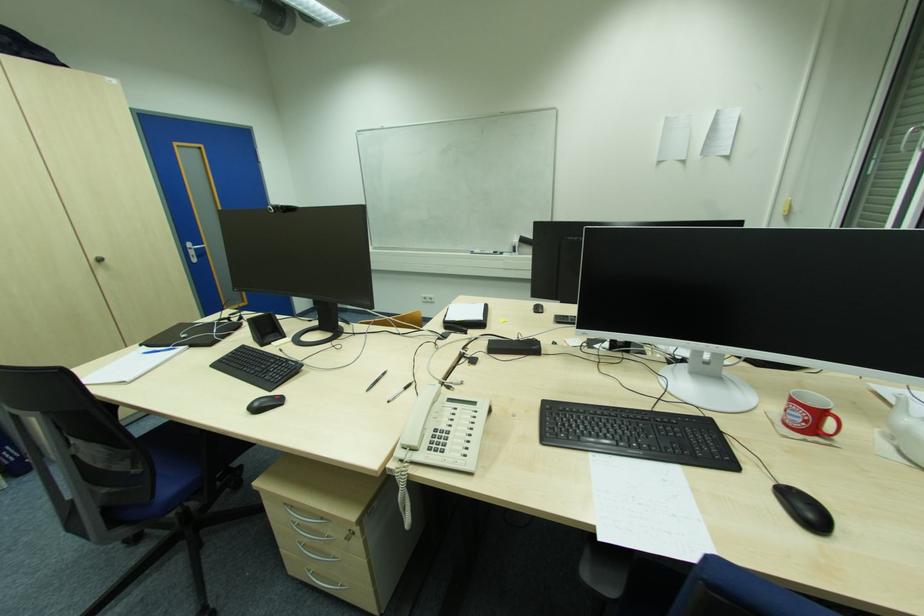
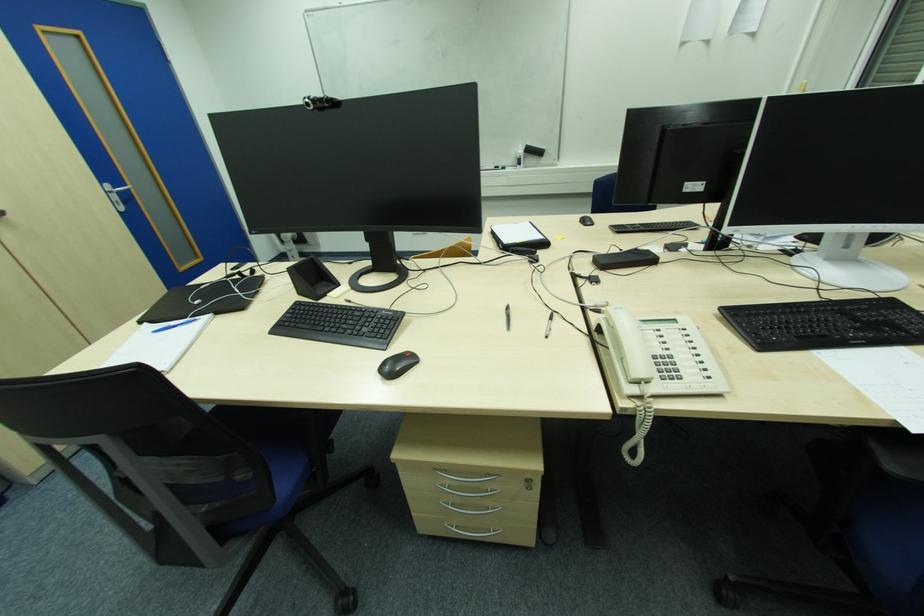
In the second image, find the point that corresponds to point 196,257 in the first image.

(119, 204)